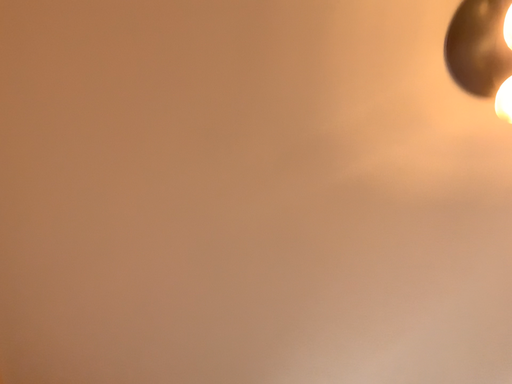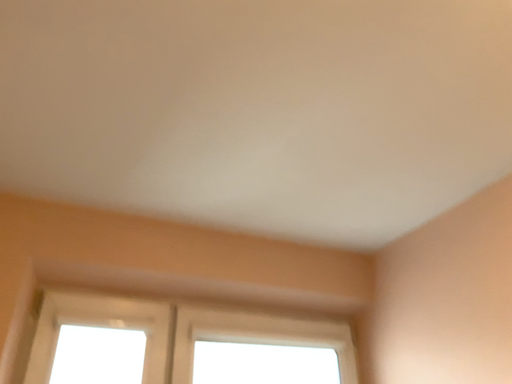
Question: How did the camera likely rotate when shooting the video?

Choices:
 (A) rotated right
 (B) rotated left

Answer: (A)